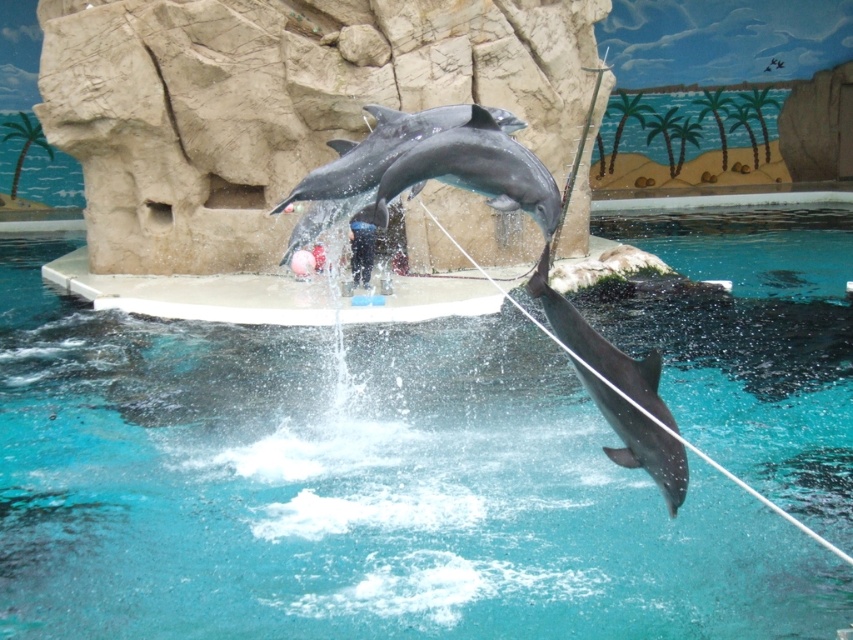
You are a photographer positioned at the edge of the pool. You want to capture a photo where the clear blue water at center is in focus while keeping the gray smooth dolphin at center somewhat blurred. Is this possible given their positions?

Yes, since the clear blue water at center is closer to the viewer than the gray smooth dolphin at center, adjusting the camera focus to the water will blur the dolphin in the background.

You are a marine biologist observing the dolphin show. You notice the clear blue water at center and the gray smooth dolphin at center. Which one is taller in this scene?

The clear blue water at center has a greater height compared to the gray smooth dolphin at center, so the clear blue water at center is taller.